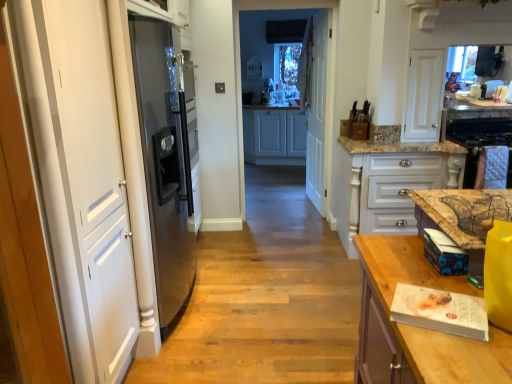
You are a GUI agent. You are given a task and a screenshot of the screen. Output one action in this format:
    pyautogui.click(x=<x>, y=<y>)
    Task: Click on the vacant space that is to the left of white wooden door at center
    
    Given the screenshot: What is the action you would take?
    pyautogui.click(x=281, y=204)